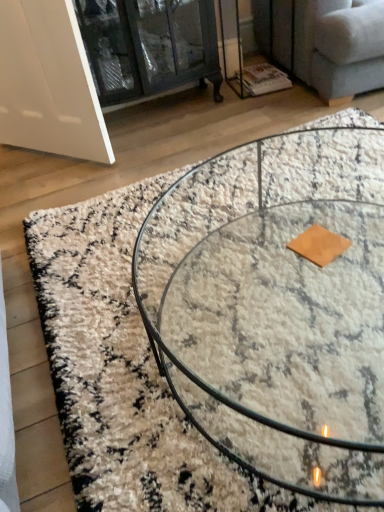
Question: Is clear glass cabinet at upper left to the left or to the right of clear glass coffee table at center in the image?

Choices:
 (A) left
 (B) right

Answer: (A)

Question: Is clear glass cabinet at upper left taller or shorter than clear glass coffee table at center?

Choices:
 (A) short
 (B) tall

Answer: (B)

Question: Estimate the real-world distances between objects in this image. Which object is farther from the clear glass coffee table at center?

Choices:
 (A) light gray fabric couch at upper right
 (B) clear glass cabinet at upper left

Answer: (B)

Question: Which is farther from the clear glass cabinet at upper left?

Choices:
 (A) light gray fabric couch at upper right
 (B) clear glass coffee table at center

Answer: (B)